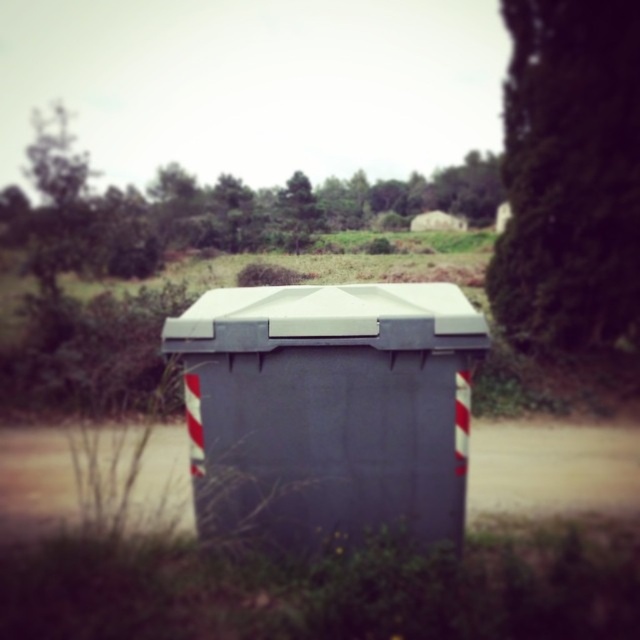
Question: Which point appears closest to the camera in this image?

Choices:
 (A) (541, 216)
 (B) (412, 292)
 (C) (157, 208)

Answer: (B)

Question: Is green leafy tree at upper right to the right of green leafy tree at upper center from the viewer's perspective?

Choices:
 (A) no
 (B) yes

Answer: (B)

Question: Which point is farther to the camera?

Choices:
 (A) gray matte container at center
 (B) green leafy tree at upper center
 (C) green leafy tree at upper right

Answer: (B)

Question: Among these objects, which one is nearest to the camera?

Choices:
 (A) green leafy tree at upper right
 (B) green leafy tree at upper center

Answer: (A)

Question: Can you confirm if gray matte container at center is smaller than green leafy tree at upper center?

Choices:
 (A) yes
 (B) no

Answer: (A)

Question: Does gray matte container at center appear under green leafy tree at upper right?

Choices:
 (A) no
 (B) yes

Answer: (B)